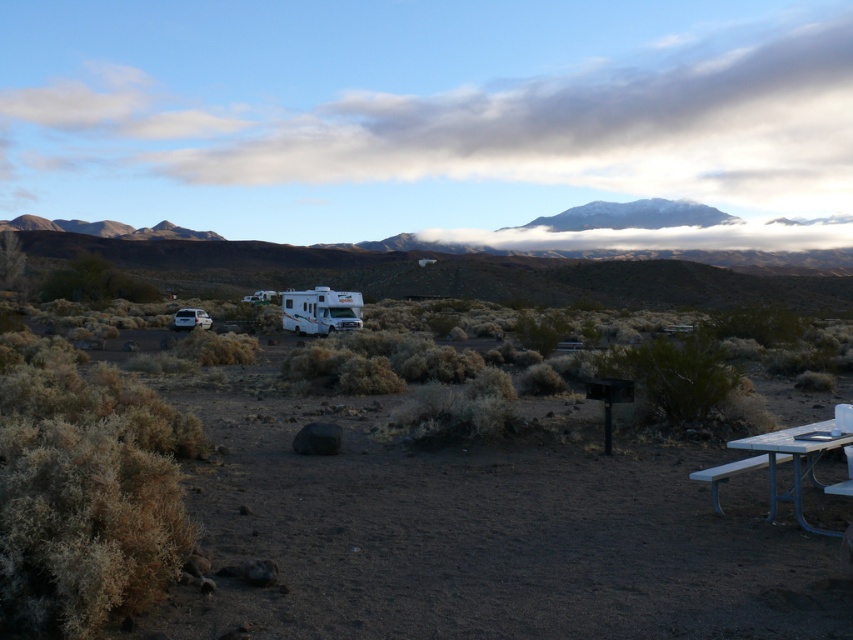
Question: Does white plastic picnic table at lower right have a smaller size compared to white matte camper at center?

Choices:
 (A) no
 (B) yes

Answer: (B)

Question: Does white plastic picnic table at center have a lesser width compared to white matte recreational vehicle at left?

Choices:
 (A) yes
 (B) no

Answer: (B)

Question: Which object is positioned farthest from the snowy rock mountain at upper center?

Choices:
 (A) white plastic picnic table at lower right
 (B) white matte recreational vehicle at left

Answer: (A)

Question: Which point appears closest to the camera in this image?

Choices:
 (A) pyautogui.click(x=801, y=518)
 (B) pyautogui.click(x=581, y=205)
 (C) pyautogui.click(x=323, y=310)

Answer: (A)

Question: Which of these objects is positioned closest to the white matte camper at center?

Choices:
 (A) white plastic picnic table at center
 (B) white plastic picnic table at lower right

Answer: (A)

Question: Is the position of white plastic picnic table at center more distant than that of white plastic picnic table at lower right?

Choices:
 (A) no
 (B) yes

Answer: (A)